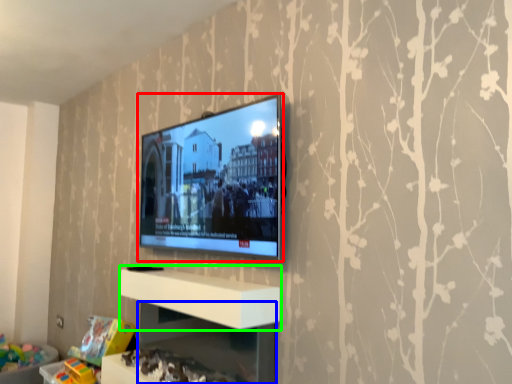
Question: Which object is positioned farthest from television (highlighted by a red box)? Select from shelf (highlighted by a blue box) and shelf (highlighted by a green box).

Choices:
 (A) shelf
 (B) shelf

Answer: (A)